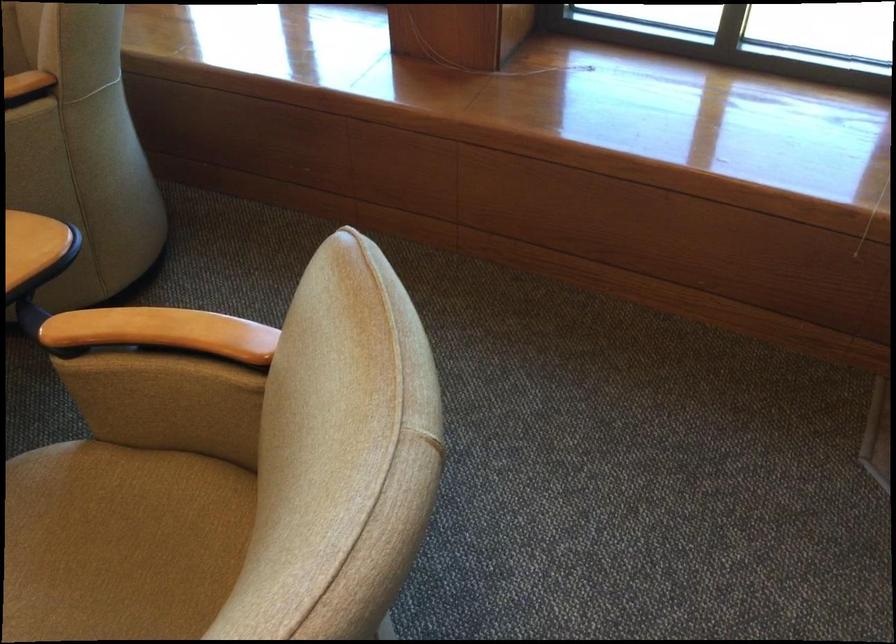
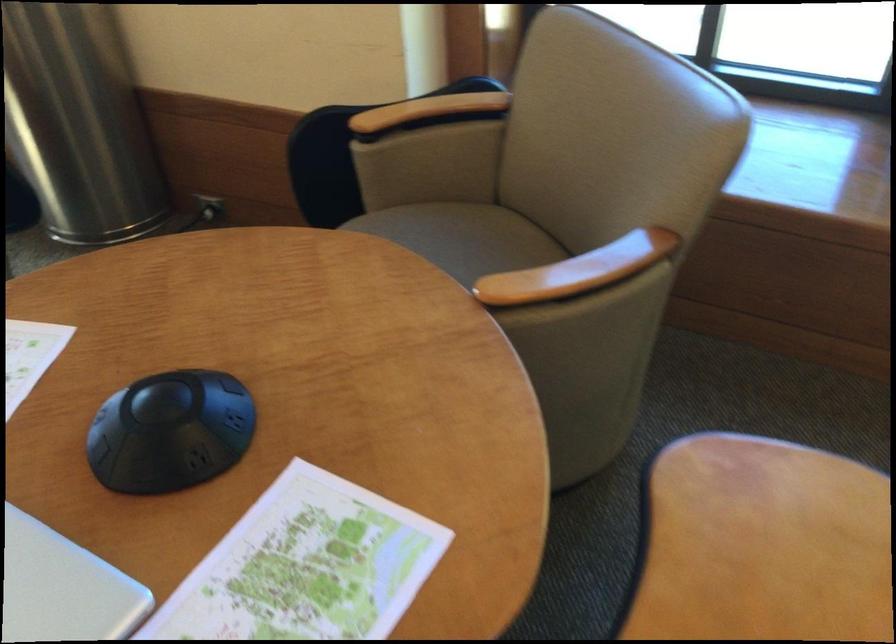
Question: The images are taken continuously from a first-person perspective. In which direction are you moving?

Choices:
 (A) Left
 (B) Right
 (C) Forward
 (D) Backward

Answer: (A)